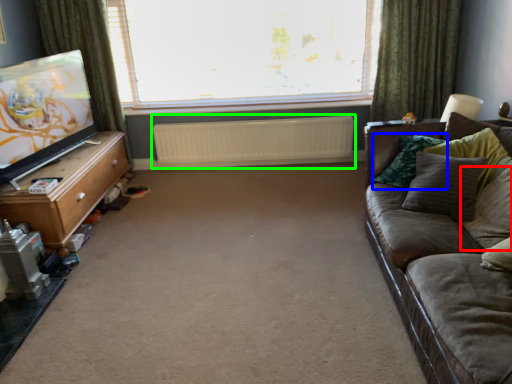
Question: Which object is the closest to the pillow (highlighted by a red box)? Choose among these: pillow (highlighted by a blue box) or radiator (highlighted by a green box).

Choices:
 (A) pillow
 (B) radiator

Answer: (A)